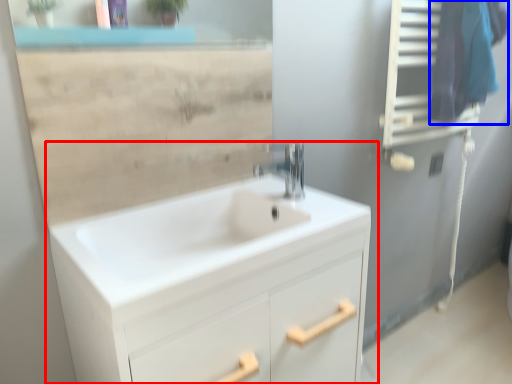
Question: Which point is further to the camera, bathroom cabinet (highlighted by a red box) or laundry (highlighted by a blue box)?

Choices:
 (A) bathroom cabinet
 (B) laundry

Answer: (B)